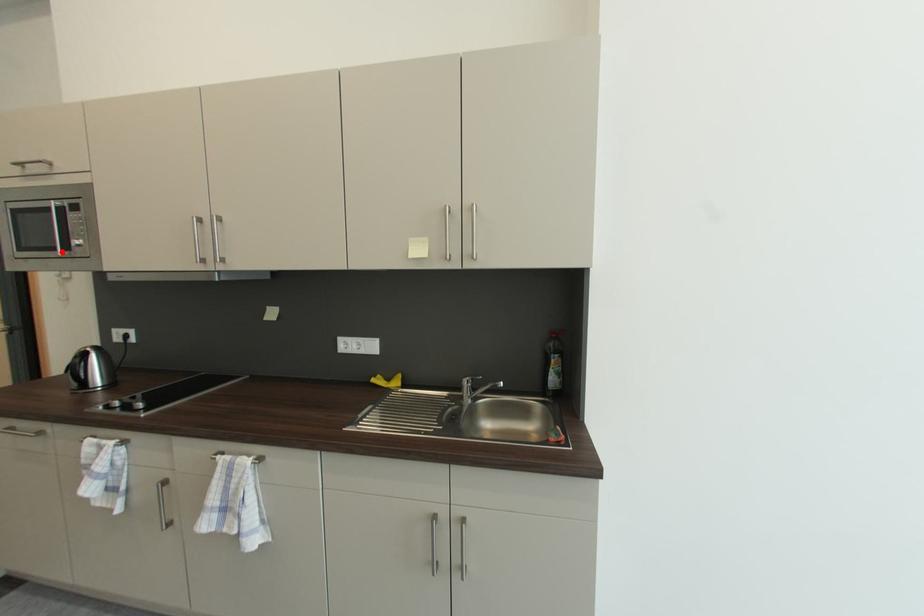
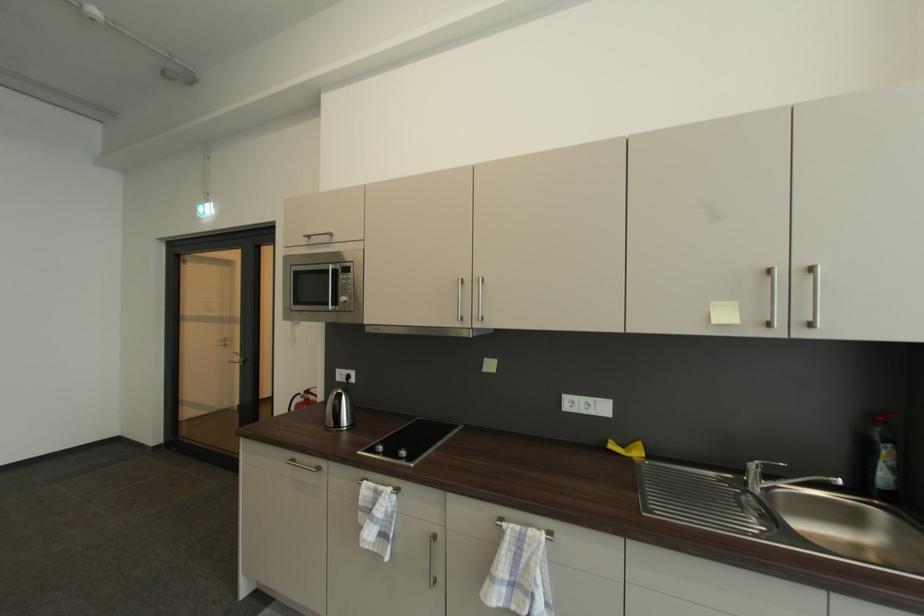
In the second image, find the point that corresponds to the highlighted location in the first image.

(334, 306)